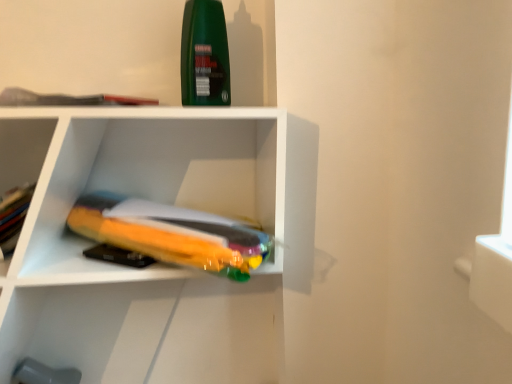
Measure the distance between point (26, 90) and camera.

Point (26, 90) is 38.82 inches from camera.

The width and height of the screenshot is (512, 384). Identify the location of matte gray book at upper left, arranged as the 1th book when viewed from the top. (67, 99).

Looking at this image, is green matte bottle at upper center inside the boundaries of translucent plastic bag at center, or outside?

green matte bottle at upper center cannot be found inside translucent plastic bag at center.

From the image's perspective, is green matte bottle at upper center located beneath translucent plastic bag at center?

Actually, green matte bottle at upper center appears above translucent plastic bag at center in the image.

Is green matte bottle at upper center facing away from translucent plastic bag at center?

No, translucent plastic bag at center is not at the back of green matte bottle at upper center.

Does green matte bottle at upper center have a lesser width compared to translucent plastic bag at center?

Indeed, green matte bottle at upper center has a lesser width compared to translucent plastic bag at center.

Between translucent orange book at center, marked as the first book in a bottom-to-top arrangement, and green matte bottle at upper center, which one is positioned behind?

green matte bottle at upper center is more distant.

In the scene shown: Considering the relative sizes of translucent orange book at center, which appears as the second book when viewed from the top, and green matte bottle at upper center in the image provided, is translucent orange book at center, which appears as the second book when viewed from the top, thinner than green matte bottle at upper center?

No, translucent orange book at center, which appears as the second book when viewed from the top, is not thinner than green matte bottle at upper center.

Find the location of a particular element. cleaning product behind the translucent orange book at center, marked as the first book in a bottom-to-top arrangement is located at coordinates (204, 55).

Who is bigger, translucent orange book at center, which appears as the second book when viewed from the top, or green matte bottle at upper center?

With larger size is translucent orange book at center, which appears as the second book when viewed from the top.

In terms of size, does green matte bottle at upper center appear bigger or smaller than matte gray book at upper left, which is the 2th book in bottom-to-top order?

In the image, green matte bottle at upper center appears to be larger than matte gray book at upper left, which is the 2th book in bottom-to-top order.

Can you see green matte bottle at upper center touching matte gray book at upper left, which is the 2th book in bottom-to-top order?

No, green matte bottle at upper center is not in contact with matte gray book at upper left, which is the 2th book in bottom-to-top order.

Could you measure the distance between green matte bottle at upper center and matte gray book at upper left, arranged as the 1th book when viewed from the top?

green matte bottle at upper center and matte gray book at upper left, arranged as the 1th book when viewed from the top, are 7.89 inches apart from each other.

From a real-world perspective, is green matte bottle at upper center located higher than matte gray book at upper left, which is the 2th book in bottom-to-top order?

Yes.

Where is `shelf that is on the left side of matte gray book at upper left, arranged as the 1th book when viewed from the top`? shelf that is on the left side of matte gray book at upper left, arranged as the 1th book when viewed from the top is located at coordinates (23, 150).

Can you confirm if matte gray book at upper left, which is the 2th book in bottom-to-top order, is shorter than translucent plastic bag at center?

Yes, matte gray book at upper left, which is the 2th book in bottom-to-top order, is shorter than translucent plastic bag at center.

Is matte gray book at upper left, which is the 2th book in bottom-to-top order, at the left side of translucent plastic bag at center?

No.

Which of these two, translucent plastic bag at center or green matte bottle at upper center, is bigger?

translucent plastic bag at center is bigger.

From the image's perspective, which one is positioned lower, translucent plastic bag at center or green matte bottle at upper center?

translucent plastic bag at center.

Is translucent plastic bag at center turned away from green matte bottle at upper center?

No, translucent plastic bag at center's orientation is not away from green matte bottle at upper center.

Is translucent plastic bag at center to the right of green matte bottle at upper center from the viewer's perspective?

In fact, translucent plastic bag at center is to the left of green matte bottle at upper center.

How much distance is there between green matte bottle at upper center and translucent orange book at center, which appears as the second book when viewed from the top?

green matte bottle at upper center is 31.01 centimeters from translucent orange book at center, which appears as the second book when viewed from the top.

Considering the points (198, 59) and (258, 260), which point is behind, point (198, 59) or point (258, 260)?

The point (198, 59) is farther.

Considering the positions of objects green matte bottle at upper center and translucent orange book at center, which appears as the second book when viewed from the top, in the image provided, who is more to the right, green matte bottle at upper center or translucent orange book at center, which appears as the second book when viewed from the top,?

green matte bottle at upper center is more to the right.

In the scene shown: From a real-world perspective, which object rests below the other?

From a 3D spatial view, translucent orange book at center, marked as the first book in a bottom-to-top arrangement, is below.

From a real-world perspective, does translucent plastic bag at center stand above translucent orange book at center, marked as the first book in a bottom-to-top arrangement?

Yes, from a real-world perspective, translucent plastic bag at center is above translucent orange book at center, marked as the first book in a bottom-to-top arrangement.

Choose the correct answer: Is translucent plastic bag at center inside translucent orange book at center, marked as the first book in a bottom-to-top arrangement, or outside it?

translucent plastic bag at center is located beyond the bounds of translucent orange book at center, marked as the first book in a bottom-to-top arrangement.

Is translucent plastic bag at center turned away from translucent orange book at center, which appears as the second book when viewed from the top?

No.

Considering the relative positions of translucent plastic bag at center and translucent orange book at center, which appears as the second book when viewed from the top, in the image provided, is translucent plastic bag at center to the right of translucent orange book at center, which appears as the second book when viewed from the top, from the viewer's perspective?

No, translucent plastic bag at center is not to the right of translucent orange book at center, which appears as the second book when viewed from the top.

Where is `cleaning product behind the translucent plastic bag at center`? This screenshot has height=384, width=512. cleaning product behind the translucent plastic bag at center is located at coordinates (204, 55).

Identify the location of the 2nd book below the green matte bottle at upper center (from a real-world perspective). (170, 233).

From the image, which object appears to be farther from translucent orange book at center, marked as the first book in a bottom-to-top arrangement, translucent plastic bag at center or green matte bottle at upper center?

Among the two, translucent plastic bag at center is located further to translucent orange book at center, marked as the first book in a bottom-to-top arrangement.

Based on the photo, estimate the real-world distances between objects in this image. Which object is further from translucent plastic bag at center, translucent orange book at center, which appears as the second book when viewed from the top, or matte gray book at upper left, which is the 2th book in bottom-to-top order?

Based on the image, translucent orange book at center, which appears as the second book when viewed from the top, appears to be further to translucent plastic bag at center.

Based on the photo, which object lies further to the anchor point translucent plastic bag at center, green matte bottle at upper center or matte gray book at upper left, arranged as the 1th book when viewed from the top?

green matte bottle at upper center.

Which object lies nearer to the anchor point green matte bottle at upper center, translucent plastic bag at center or translucent orange book at center, marked as the first book in a bottom-to-top arrangement?

Based on the image, translucent orange book at center, marked as the first book in a bottom-to-top arrangement, appears to be nearer to green matte bottle at upper center.

Looking at the image, which one is located closer to translucent plastic bag at center, matte gray book at upper left, arranged as the 1th book when viewed from the top, or translucent orange book at center, which appears as the second book when viewed from the top?

Based on the image, matte gray book at upper left, arranged as the 1th book when viewed from the top, appears to be nearer to translucent plastic bag at center.

From the image, which object appears to be nearer to green matte bottle at upper center, matte gray book at upper left, which is the 2th book in bottom-to-top order, or translucent plastic bag at center?

Based on the image, matte gray book at upper left, which is the 2th book in bottom-to-top order, appears to be nearer to green matte bottle at upper center.

Looking at the image, which one is located further to matte gray book at upper left, arranged as the 1th book when viewed from the top, green matte bottle at upper center or translucent plastic bag at center?

Among the two, green matte bottle at upper center is located further to matte gray book at upper left, arranged as the 1th book when viewed from the top.

Looking at this image, estimate the real-world distances between objects in this image. Which object is further from translucent orange book at center, marked as the first book in a bottom-to-top arrangement, translucent plastic bag at center or matte gray book at upper left, arranged as the 1th book when viewed from the top?

translucent plastic bag at center is further to translucent orange book at center, marked as the first book in a bottom-to-top arrangement.

Image resolution: width=512 pixels, height=384 pixels. Find the location of `book between green matte bottle at upper center and translucent orange book at center, which appears as the second book when viewed from the top, from top to bottom`. book between green matte bottle at upper center and translucent orange book at center, which appears as the second book when viewed from the top, from top to bottom is located at coordinates (67, 99).

I want to click on shelf that lies between green matte bottle at upper center and translucent orange book at center, which appears as the second book when viewed from the top, from top to bottom, so click(23, 150).

Where is `shelf between matte gray book at upper left, arranged as the 1th book when viewed from the top, and translucent orange book at center, which appears as the second book when viewed from the top, in the vertical direction`? The width and height of the screenshot is (512, 384). shelf between matte gray book at upper left, arranged as the 1th book when viewed from the top, and translucent orange book at center, which appears as the second book when viewed from the top, in the vertical direction is located at coordinates (23, 150).